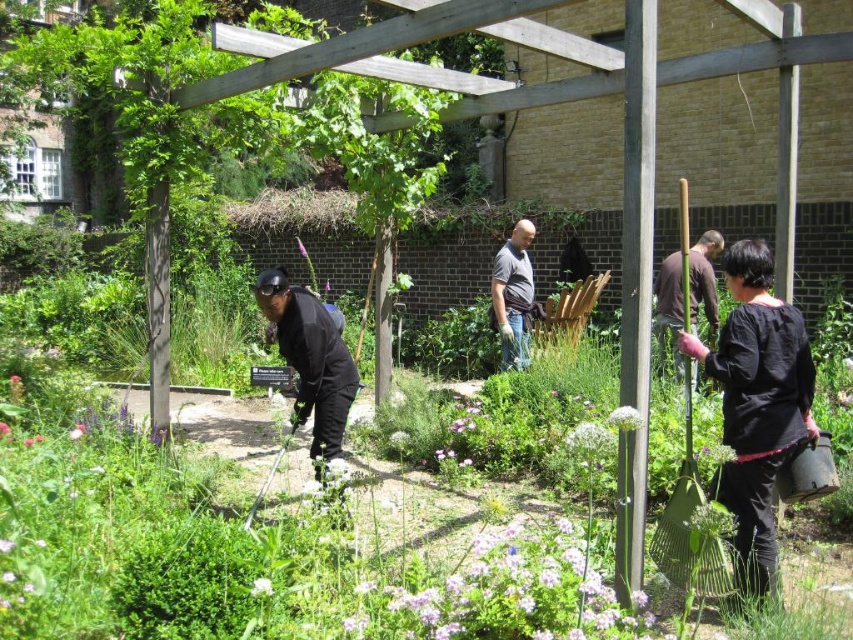
Question: Does black matte jacket at lower left have a greater width compared to dark gray shirt at center?

Choices:
 (A) yes
 (B) no

Answer: (A)

Question: Which of the following is the closest to the observer?

Choices:
 (A) brown fabric shirt at right
 (B) black matte jacket at lower left
 (C) dark gray shirt at center

Answer: (B)

Question: Which point appears farthest from the camera in this image?

Choices:
 (A) (312, 364)
 (B) (526, 241)

Answer: (B)

Question: Does black matte jacket at lower left appear under dark gray shirt at center?

Choices:
 (A) no
 (B) yes

Answer: (B)

Question: Can you confirm if black matte jacket at lower left is positioned to the right of brown fabric shirt at right?

Choices:
 (A) yes
 (B) no

Answer: (B)

Question: Based on their relative distances, which object is nearer to the brown fabric shirt at right?

Choices:
 (A) dark gray shirt at center
 (B) black matte shirt at lower right

Answer: (A)